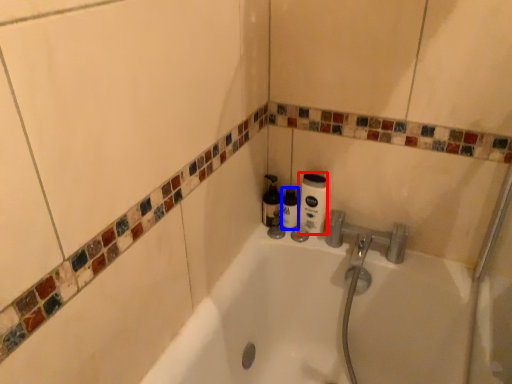
Question: Which point is closer to the camera, cleaning product (highlighted by a red box) or toiletry (highlighted by a blue box)?

Choices:
 (A) cleaning product
 (B) toiletry

Answer: (A)